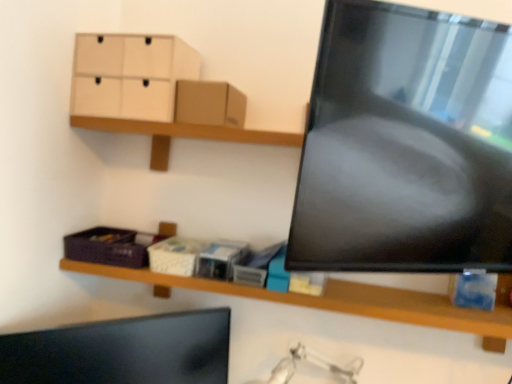
Question: From the image's perspective, is brown cardboard box at upper center located above or below purple woven basket at lower left, the first storage box viewed from the left?

Choices:
 (A) below
 (B) above

Answer: (B)

Question: Is brown cardboard box at upper center taller or shorter than purple woven basket at lower left, the third storage box when ordered from right to left?

Choices:
 (A) short
 (B) tall

Answer: (B)

Question: Estimate the real-world distances between objects in this image. Which object is closer to the brown cardboard box at upper center?

Choices:
 (A) white matte storage box at center, marked as the 1th storage box in a right-to-left arrangement
 (B) matte black monitor at lower left
 (C) wooden shelf at lower center
 (D) white cardboard tissue box at center, which is counted as the second storage box, starting from the left
 (E) purple woven basket at lower left, the third storage box when ordered from right to left

Answer: (A)

Question: Estimate the real-world distances between objects in this image. Which object is farther from the brown cardboard box at upper center?

Choices:
 (A) wooden shelf at lower center
 (B) purple woven basket at lower left, the first storage box viewed from the left
 (C) white matte storage box at center, marked as the 1th storage box in a right-to-left arrangement
 (D) matte black monitor at lower left
 (E) light beige cardboard drawer at upper left

Answer: (D)